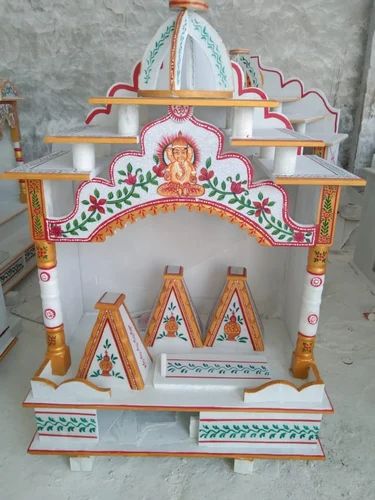
Where is `wall`? This screenshot has width=375, height=500. wall is located at coordinates (75, 48), (326, 44).